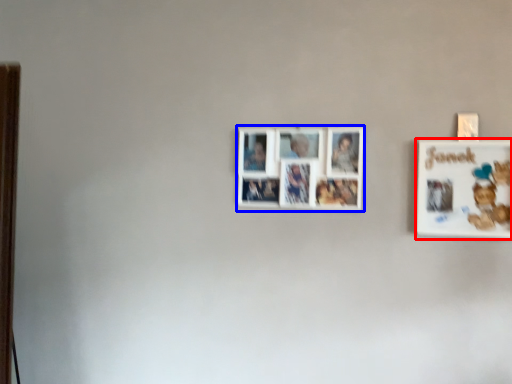
Question: Which object is further to the camera taking this photo, picture frame (highlighted by a red box) or picture frame (highlighted by a blue box)?

Choices:
 (A) picture frame
 (B) picture frame

Answer: (B)